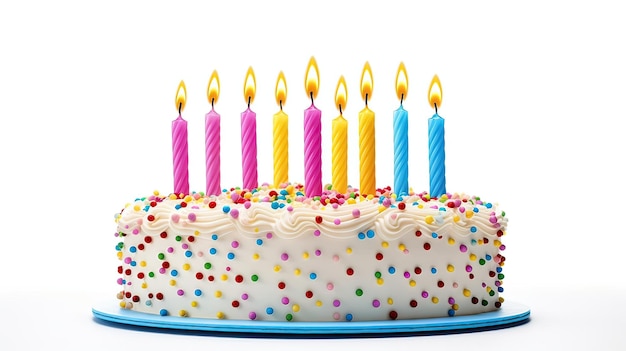
I want to click on birthday candles, so click(178, 155), click(210, 149), click(247, 150), click(279, 151), click(313, 145), click(339, 145), click(367, 145), click(403, 145), click(439, 154).